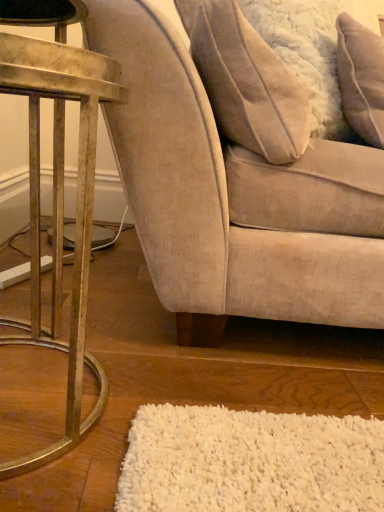
Question: In terms of width, does beige fabric pillow at upper right, which is counted as the 2th pillow, starting from the right, look wider or thinner when compared to metallic gold table at left?

Choices:
 (A) thin
 (B) wide

Answer: (A)

Question: From a real-world perspective, is beige fabric pillow at upper right, which is counted as the 2th pillow, starting from the right, above or below metallic gold table at left?

Choices:
 (A) below
 (B) above

Answer: (B)

Question: Considering the real-world distances, which object is closest to the metallic gold table at left?

Choices:
 (A) beige fabric chair at center
 (B) beige fabric pillow at upper right, positioned as the 1th pillow in left-to-right order
 (C) white fluffy pillow at upper right, the second pillow from the left

Answer: (A)

Question: Which object is positioned farthest from the metallic gold table at left?

Choices:
 (A) beige fabric pillow at upper right, positioned as the 1th pillow in left-to-right order
 (B) white fluffy pillow at upper right, the first pillow in the right-to-left sequence
 (C) beige fabric chair at center

Answer: (B)